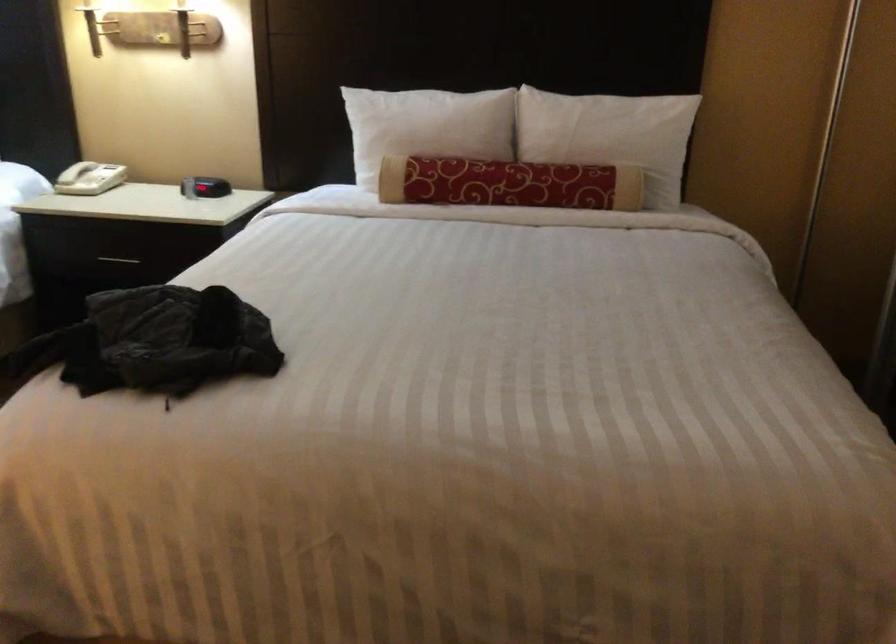
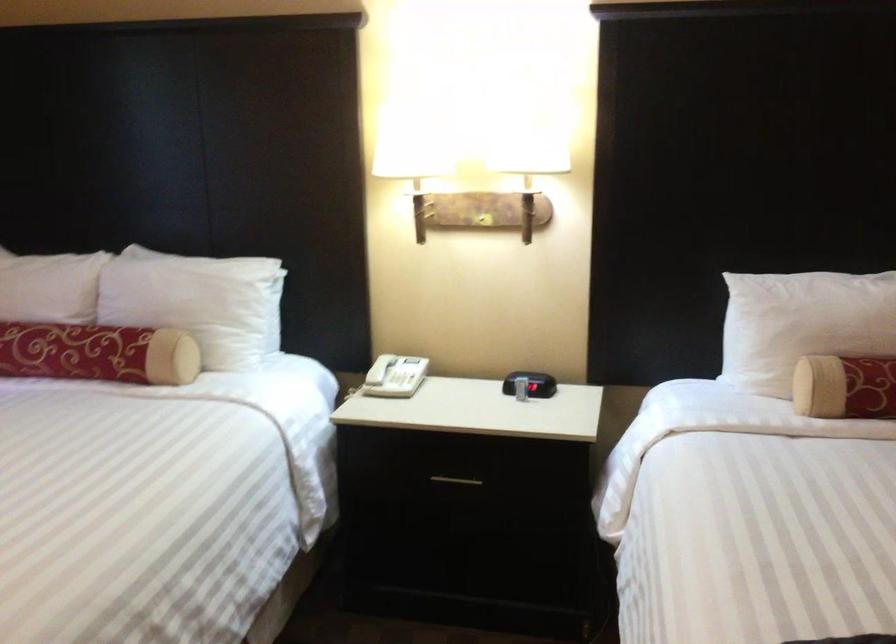
Based on the photo, the images are taken continuously from a first-person perspective. In which direction are you moving?

The movement direction of the cameraman is left, forward.